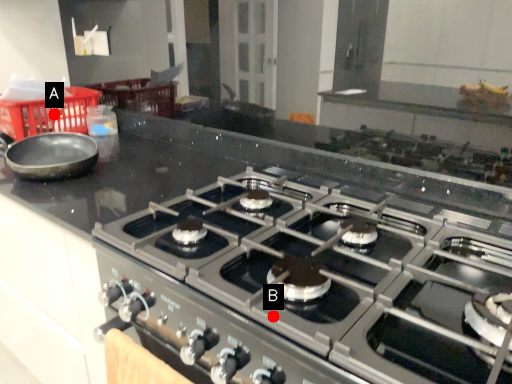
Question: Two points are circled on the image, labeled by A and B beside each circle. Among these points, which one is farthest from the camera?

Choices:
 (A) A is further
 (B) B is further

Answer: (A)